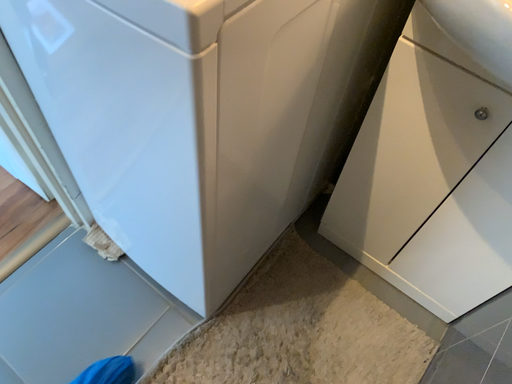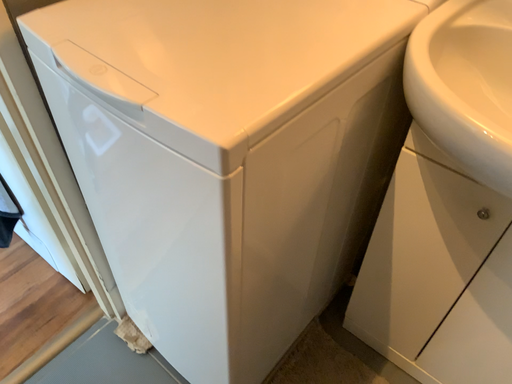
Question: How did the camera likely rotate when shooting the video?

Choices:
 (A) rotated downward
 (B) rotated upward

Answer: (B)